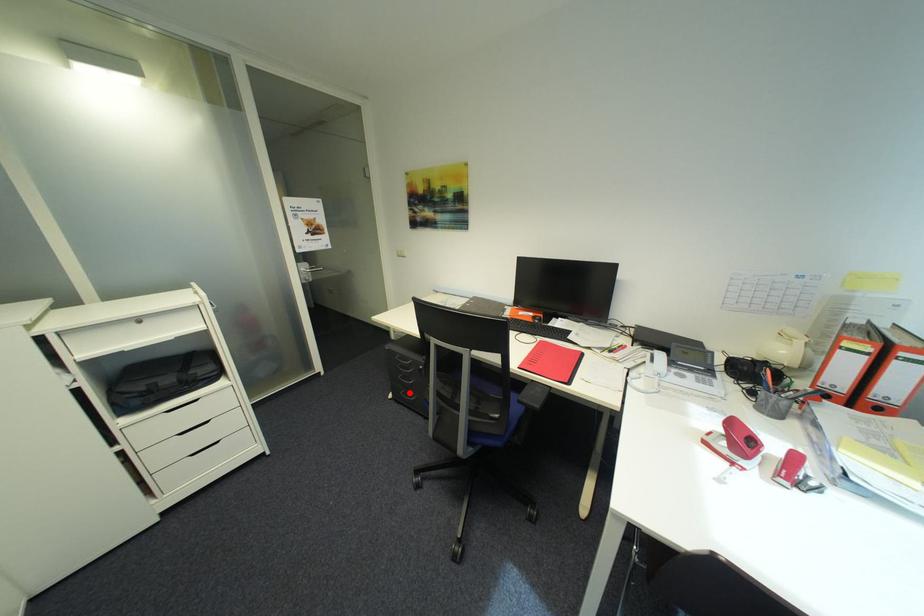
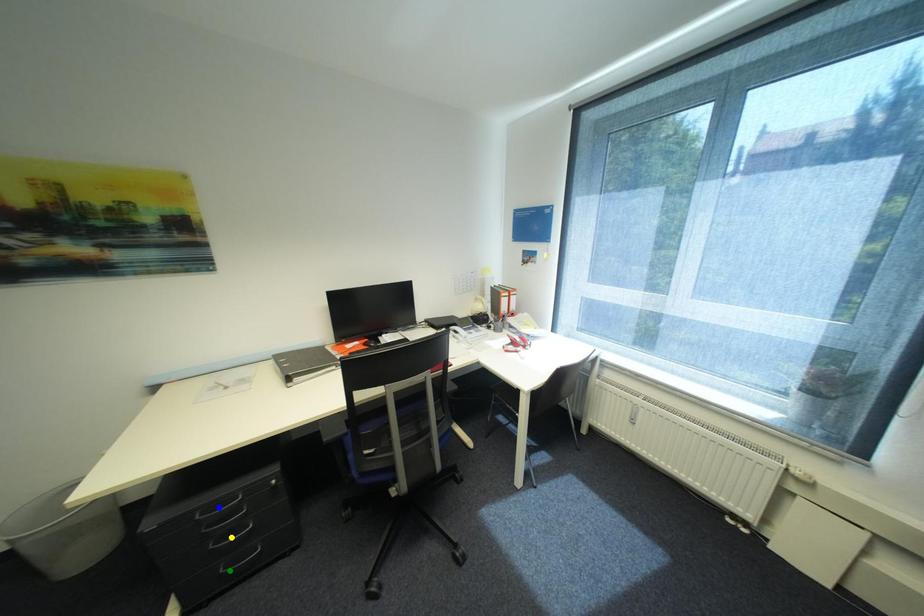
Question: I am providing you with two images of the same scene from different viewpoints. A red point is marked on the first image. You are given multiple points on the second image. Which point in image 2 represents the same 3d spot as the red point in image 1?

Choices:
 (A) green point
 (B) blue point
 (C) yellow point

Answer: (A)